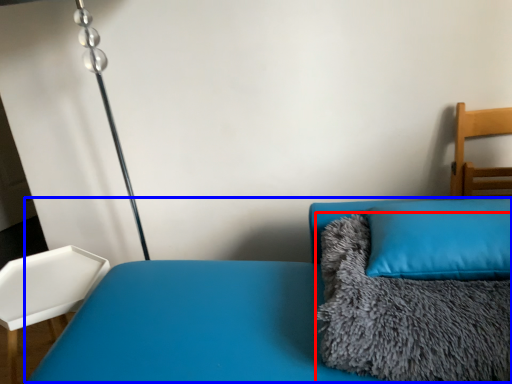
Question: Among these objects, which one is nearest to the camera, blanket (highlighted by a red box) or couch (highlighted by a blue box)?

Choices:
 (A) blanket
 (B) couch

Answer: (B)